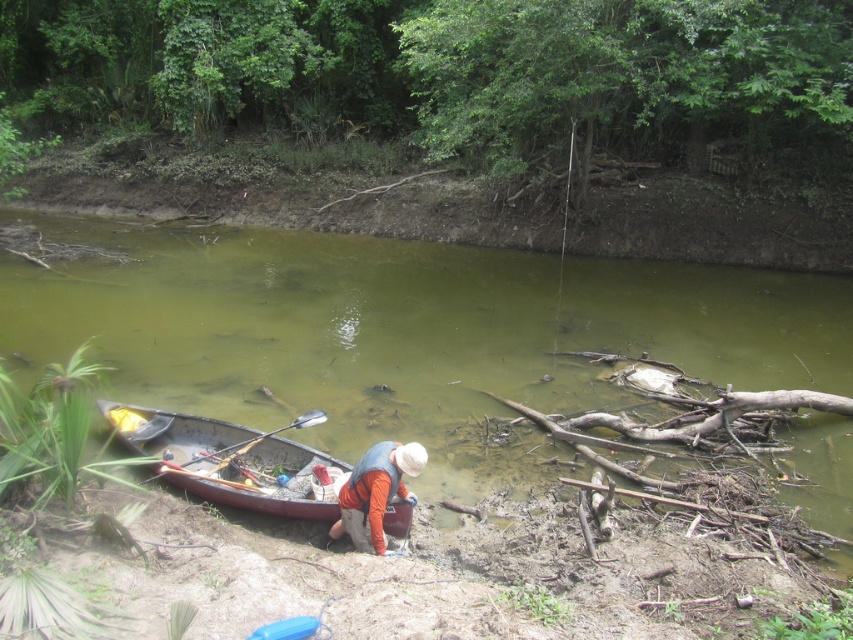
Question: Is wooden canoe at lower center positioned behind wooden polished paddle at lower center?

Choices:
 (A) yes
 (B) no

Answer: (B)

Question: Can you confirm if wooden canoe at lower center is smaller than orange fabric at lower center?

Choices:
 (A) yes
 (B) no

Answer: (B)

Question: Can you confirm if wooden canoe at lower center is thinner than wooden polished paddle at lower center?

Choices:
 (A) no
 (B) yes

Answer: (A)

Question: Which object is closer to the camera taking this photo?

Choices:
 (A) wooden canoe at lower center
 (B) wooden polished paddle at lower center

Answer: (A)

Question: Which object appears closest to the camera in this image?

Choices:
 (A) green murky water at center
 (B) wooden canoe at lower center
 (C) wooden polished paddle at lower center
 (D) orange fabric at lower center

Answer: (D)

Question: Which point is closer to the camera taking this photo?

Choices:
 (A) (206, 458)
 (B) (219, 428)
 (C) (318, 428)

Answer: (A)